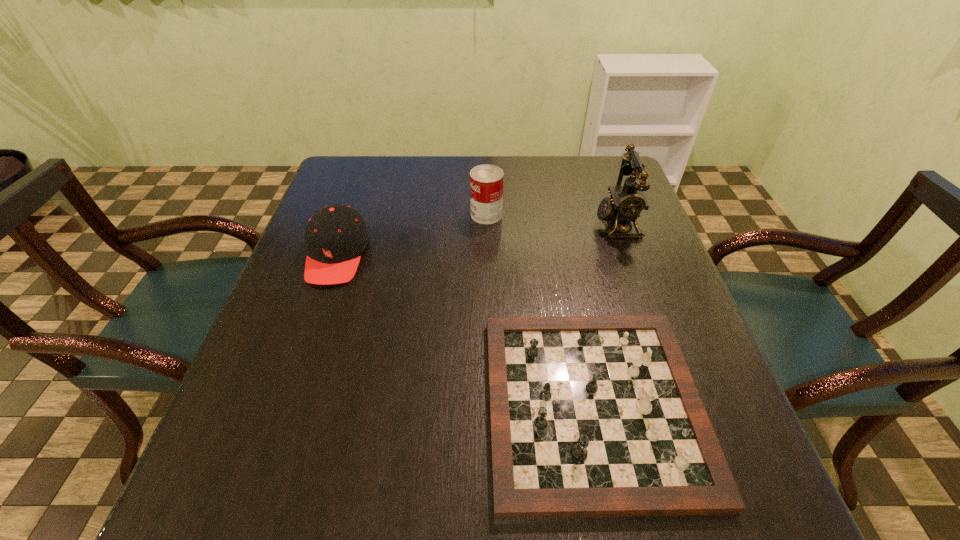
In the image, there is a desktop. Identify the location of vacant space at the near edge. This screenshot has width=960, height=540. (459, 526).

What are the coordinates of `free space at the left edge` in the screenshot? It's located at (300, 342).

In the image, there is a desktop. At what (x,y) coordinates should I click in order to perform the action: click on blank space at the right edge. Please return your answer as a coordinate pair (x, y). Looking at the image, I should click on (622, 282).

I want to click on vacant space at the far left corner, so click(339, 173).

The height and width of the screenshot is (540, 960). Identify the location of vacant area between the second tallest object and the tallest object. (552, 219).

You are a GUI agent. You are given a task and a screenshot of the screen. Output one action in this format:
    pyautogui.click(x=<x>, y=<y>)
    Task: Click on the vacant region between the tallest object and the shortest object
    
    Given the screenshot: What is the action you would take?
    pyautogui.click(x=605, y=314)

Find the location of a particular element. This screenshot has width=960, height=540. vacant area that lies between the telephone and the second tallest object is located at coordinates (552, 219).

This screenshot has width=960, height=540. Find the location of `free spot between the cap and the tallest object`. free spot between the cap and the tallest object is located at coordinates (477, 239).

Find the location of `vacant space in between the can and the shortest object`. vacant space in between the can and the shortest object is located at coordinates (540, 310).

Image resolution: width=960 pixels, height=540 pixels. I want to click on free space between the telephone and the can, so click(552, 219).